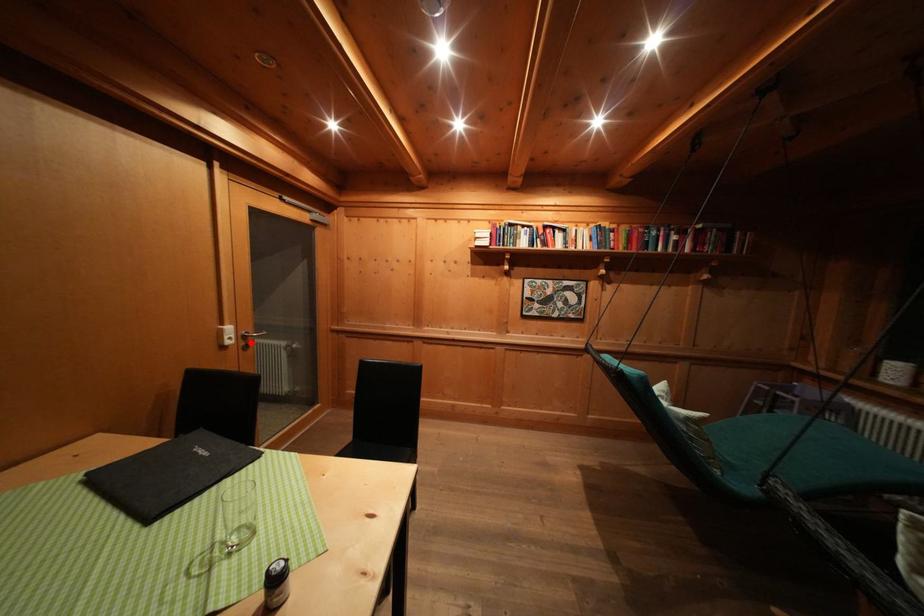
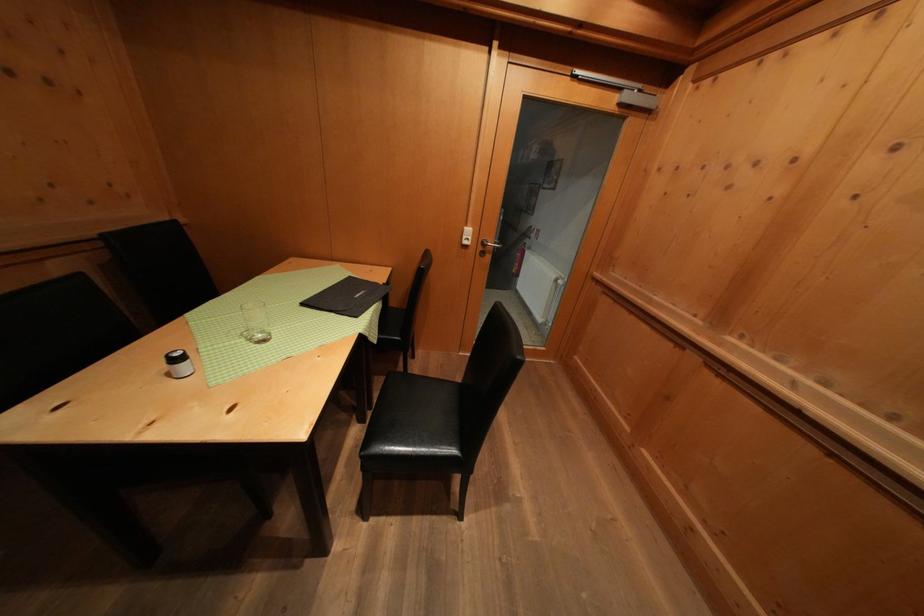
The point at the highlighted location is marked in the first image. Where is the corresponding point in the second image?

(490, 249)